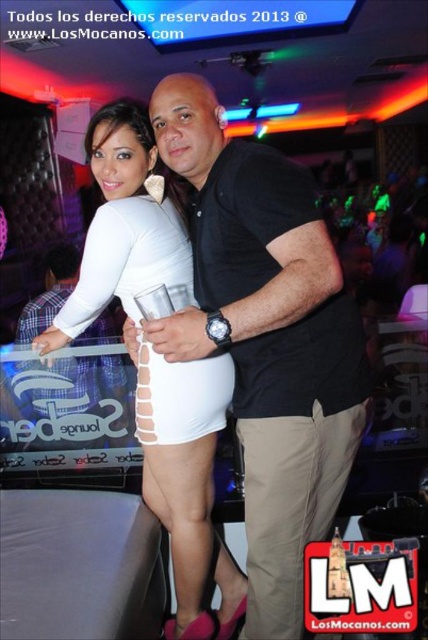
Question: Where is black matte shirt at center located in relation to white matte skirt at center in the image?

Choices:
 (A) left
 (B) right

Answer: (B)

Question: Which point is farther from the camera taking this photo?

Choices:
 (A) (175, 540)
 (B) (169, 163)

Answer: (A)

Question: Which of the following is the closest to the observer?

Choices:
 (A) (270, 524)
 (B) (62, 307)
 (C) (279, 438)
 (D) (109, 129)

Answer: (C)

Question: Does white matte skirt at center appear over white matte dress at center?

Choices:
 (A) yes
 (B) no

Answer: (B)

Question: Can you confirm if black matte shirt at center is thinner than tan cotton pants at center?

Choices:
 (A) yes
 (B) no

Answer: (B)

Question: Which of the following is the closest to the observer?

Choices:
 (A) tan cotton pants at center
 (B) black matte shirt at center
 (C) white matte dress at center
 (D) white matte skirt at center

Answer: (B)